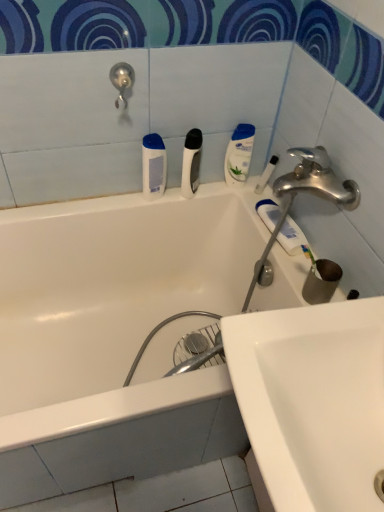
Question: From a real-world perspective, is white glossy lotion at upper right, the third toiletry from the left, physically below white matte razor at center, arranged as the 3th toiletry when viewed from the right?

Choices:
 (A) no
 (B) yes

Answer: (B)

Question: Can you confirm if white glossy lotion at upper right, the third toiletry from the left, is smaller than white matte razor at center, arranged as the 3th toiletry when viewed from the right?

Choices:
 (A) no
 (B) yes

Answer: (B)

Question: Is white glossy lotion at upper right, the third toiletry from the left, not inside white matte razor at center, the 2th toiletry when ordered from left to right?

Choices:
 (A) no
 (B) yes

Answer: (B)

Question: Can you confirm if white glossy lotion at upper right, which is the second toiletry from right to left, is thinner than white matte razor at center, the 2th toiletry when ordered from left to right?

Choices:
 (A) yes
 (B) no

Answer: (A)

Question: Is white glossy lotion at upper right, the third toiletry from the left, oriented towards white matte razor at center, arranged as the 3th toiletry when viewed from the right?

Choices:
 (A) no
 (B) yes

Answer: (A)

Question: From the image's perspective, is clear plastic toothbrush at upper right, acting as the first toiletry starting from the right, above or below white glossy bathtub at upper center?

Choices:
 (A) above
 (B) below

Answer: (A)

Question: Is clear plastic toothbrush at upper right, marked as the fourth toiletry in a left-to-right arrangement, in front of or behind white glossy bathtub at upper center in the image?

Choices:
 (A) front
 (B) behind

Answer: (B)

Question: From a real-world perspective, is clear plastic toothbrush at upper right, marked as the fourth toiletry in a left-to-right arrangement, above or below white glossy bathtub at upper center?

Choices:
 (A) below
 (B) above

Answer: (B)

Question: Which is correct: clear plastic toothbrush at upper right, marked as the fourth toiletry in a left-to-right arrangement, is inside white glossy bathtub at upper center, or outside of it?

Choices:
 (A) inside
 (B) outside

Answer: (B)

Question: In the image, is white matte bottle at upper center, arranged as the first toiletry when viewed from the left, on the left side or the right side of satin nickel showerhead at upper left?

Choices:
 (A) left
 (B) right

Answer: (B)

Question: Would you say white matte bottle at upper center, arranged as the first toiletry when viewed from the left, is inside or outside satin nickel showerhead at upper left?

Choices:
 (A) outside
 (B) inside

Answer: (A)

Question: Is point (152, 151) closer or farther from the camera than point (117, 81)?

Choices:
 (A) farther
 (B) closer

Answer: (A)

Question: In terms of width, does white matte bottle at upper center, which is the fourth toiletry from right to left, look wider or thinner when compared to satin nickel showerhead at upper left?

Choices:
 (A) wide
 (B) thin

Answer: (B)

Question: In the image, is white glossy lotion at upper right, which is the second toiletry from right to left, on the left side or the right side of white matte bottle at upper center, arranged as the first toiletry when viewed from the left?

Choices:
 (A) right
 (B) left

Answer: (A)

Question: Relative to white matte bottle at upper center, which is the fourth toiletry from right to left, is white glossy lotion at upper right, which is the second toiletry from right to left, in front or behind?

Choices:
 (A) behind
 (B) front

Answer: (A)